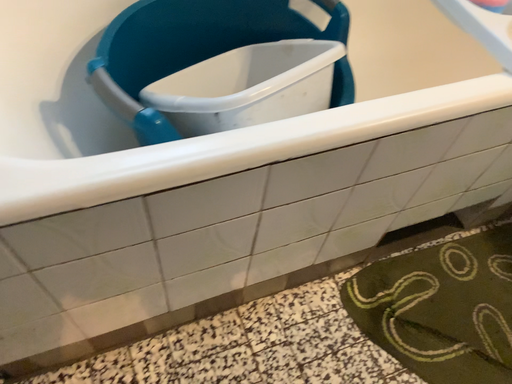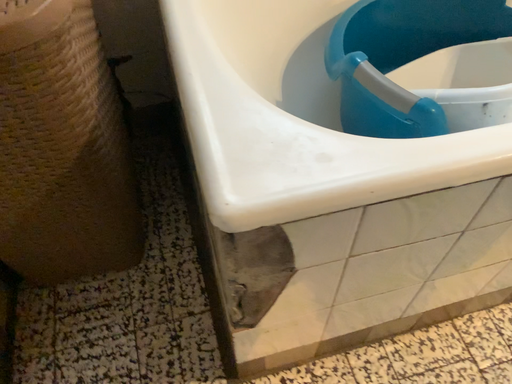
Question: How did the camera likely rotate when shooting the video?

Choices:
 (A) rotated right
 (B) rotated left

Answer: (B)